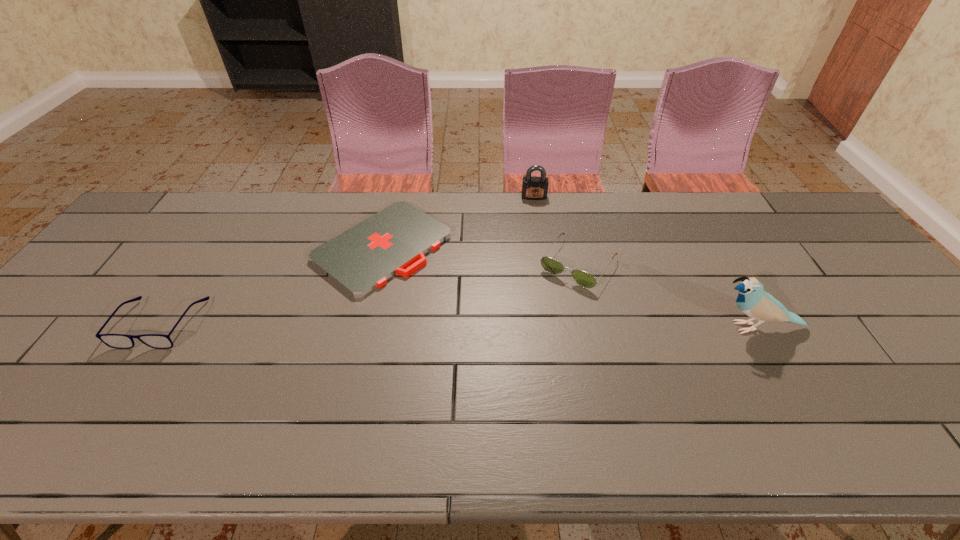
Identify the location of empty space that is in between the shortest object and the sunglasses. The height and width of the screenshot is (540, 960). (481, 255).

You are a GUI agent. You are given a task and a screenshot of the screen. Output one action in this format:
    pyautogui.click(x=<x>, y=<y>)
    Task: Click on the empty location between the rightmost object and the spectacles
    The height and width of the screenshot is (540, 960).
    Given the screenshot: What is the action you would take?
    [x=459, y=326]

Image resolution: width=960 pixels, height=540 pixels. In order to click on free space between the spectacles and the tallest object in this screenshot , I will do `click(459, 326)`.

This screenshot has height=540, width=960. In order to click on free space between the first-aid kit and the sunglasses in this screenshot , I will do `click(481, 255)`.

The image size is (960, 540). I want to click on free area in between the sunglasses and the second tallest object, so click(x=556, y=230).

You are a GUI agent. You are given a task and a screenshot of the screen. Output one action in this format:
    pyautogui.click(x=<x>, y=<y>)
    Task: Click on the unoccupied position between the sunglasses and the padlock
    
    Given the screenshot: What is the action you would take?
    pyautogui.click(x=556, y=230)

Locate an element on the screen. Image resolution: width=960 pixels, height=540 pixels. object that can be found as the second closest to the sunglasses is located at coordinates (533, 188).

Locate which object ranks third in proximity to the tallest object. Please provide its 2D coordinates. Your answer should be formatted as a tuple, i.e. [(x, y)], where the tuple contains the x and y coordinates of a point satisfying the conditions above.

[(363, 258)]

I want to click on blank space that satisfies the following two spatial constraints: 1. on the front-facing side of the tallest object; 2. at the face of the leftmost object, so click(x=158, y=327).

Image resolution: width=960 pixels, height=540 pixels. Identify the location of free space in the image that satisfies the following two spatial constraints: 1. on the front-facing side of the rightmost object; 2. at the face of the spectacles. (158, 327).